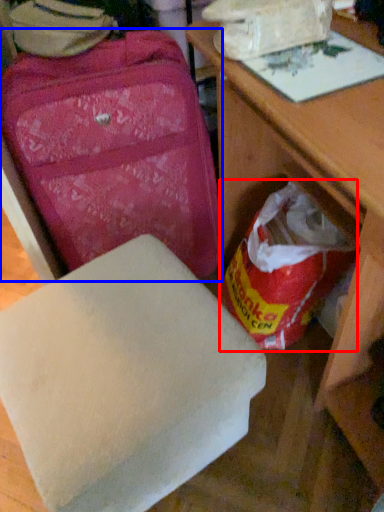
Question: Which object appears farthest to the camera in this image, grocery bag (highlighted by a red box) or suitcase (highlighted by a blue box)?

Choices:
 (A) grocery bag
 (B) suitcase

Answer: (A)